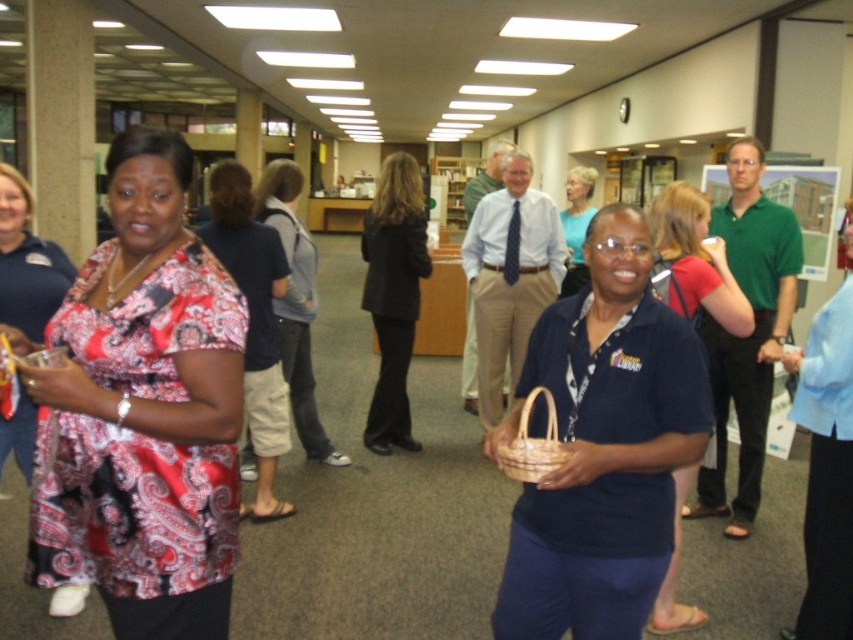
Is paisley fabric blouse at left smaller than patterned silk blouse at left?

Incorrect, paisley fabric blouse at left is not smaller in size than patterned silk blouse at left.

Between paisley fabric blouse at left and patterned silk blouse at left, which one appears on the right side from the viewer's perspective?

From the viewer's perspective, paisley fabric blouse at left appears more on the right side.

This screenshot has height=640, width=853. Find the location of `paisley fabric blouse at left`. paisley fabric blouse at left is located at coordinates (253, 321).

This screenshot has width=853, height=640. I want to click on paisley fabric blouse at left, so click(253, 321).

Between patterned silk blouse at left and blue knit sweater at center, which one has more height?

Standing taller between the two is blue knit sweater at center.

Looking at this image, who is more distant from viewer, (22, 211) or (575, 259)?

Positioned behind is point (575, 259).

Is point (33, 426) closer to camera compared to point (585, 269)?

Yes, it is in front of point (585, 269).

Locate an element on the screen. This screenshot has width=853, height=640. patterned silk blouse at left is located at coordinates (27, 260).

Which of these two, paisley fabric blouse at left or dark blue shirt at center, stands shorter?

Standing shorter between the two is dark blue shirt at center.

Is point (259, 248) behind point (677, 548)?

That is True.

Find the location of a particular element. paisley fabric blouse at left is located at coordinates (253, 321).